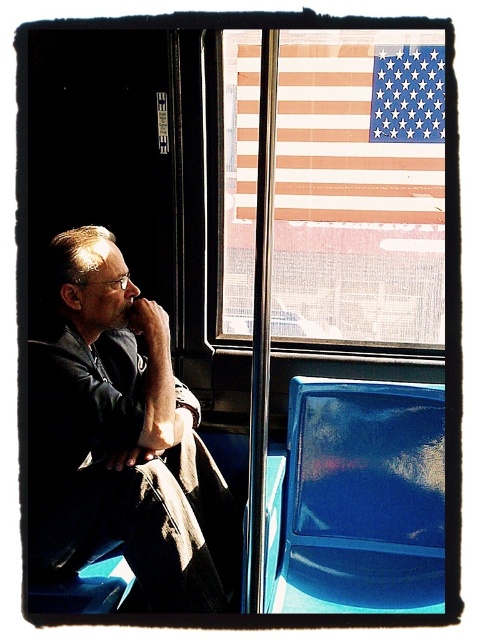
Between matte black coat at left and glossy blue seat at lower right, which one has more height?

Standing taller between the two is matte black coat at left.

Does matte black coat at left have a lesser height compared to glossy blue seat at lower right?

No.

Is point (179, 604) more distant than point (384, 458)?

That is False.

You are a GUI agent. You are given a task and a screenshot of the screen. Output one action in this format:
    pyautogui.click(x=<x>, y=<y>)
    Task: Click on the matte black coat at left
    This screenshot has width=480, height=640.
    Given the screenshot: What is the action you would take?
    pyautogui.click(x=120, y=438)

In the scene shown: Does glossy blue seat at lower right have a lesser height compared to american flag at upper right?

Yes.

What do you see at coordinates (360, 497) in the screenshot? Image resolution: width=480 pixels, height=640 pixels. I see `glossy blue seat at lower right` at bounding box center [360, 497].

Who is more forward, [280,509] or [375,173]?

Point [280,509] is in front.

Find the location of a particular element. glossy blue seat at lower right is located at coordinates (360, 497).

Can you confirm if matte black coat at left is taller than american flag at upper right?

Indeed, matte black coat at left has a greater height compared to american flag at upper right.

Find the location of `matte black coat at left`. matte black coat at left is located at coordinates (120, 438).